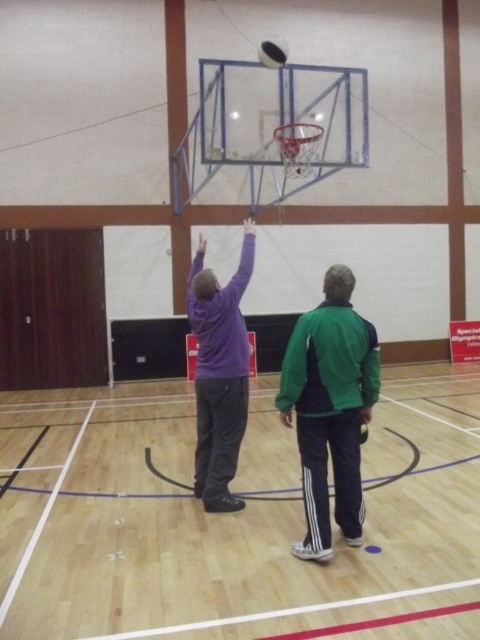
Is point (97, 499) behind point (240, 285)?

Yes, it is.

How far apart are wooden floor at center and purple fleece jacket at center?

wooden floor at center is 6.03 feet from purple fleece jacket at center.

Which is in front, point (415, 480) or point (229, 280)?

Point (415, 480)

Locate an element on the screen. This screenshot has width=480, height=640. wooden floor at center is located at coordinates (195, 531).

Based on the photo, between purple fleece jacket at center and glossy black basketball at upper center, which one appears on the right side from the viewer's perspective?

glossy black basketball at upper center

Based on the photo, can you confirm if purple fleece jacket at center is bigger than glossy black basketball at upper center?

Yes.

Locate an element on the screen. This screenshot has height=640, width=480. purple fleece jacket at center is located at coordinates (219, 372).

Can you confirm if green fabric jacket at center is taller than glossy black basketball at upper center?

Yes, green fabric jacket at center is taller than glossy black basketball at upper center.

Can you confirm if green fabric jacket at center is thinner than glossy black basketball at upper center?

Incorrect, green fabric jacket at center's width is not less than glossy black basketball at upper center's.

Does point (316, 369) come in front of point (263, 49)?

Yes, it is.

In order to click on green fabric jacket at center in this screenshot , I will do `click(330, 408)`.